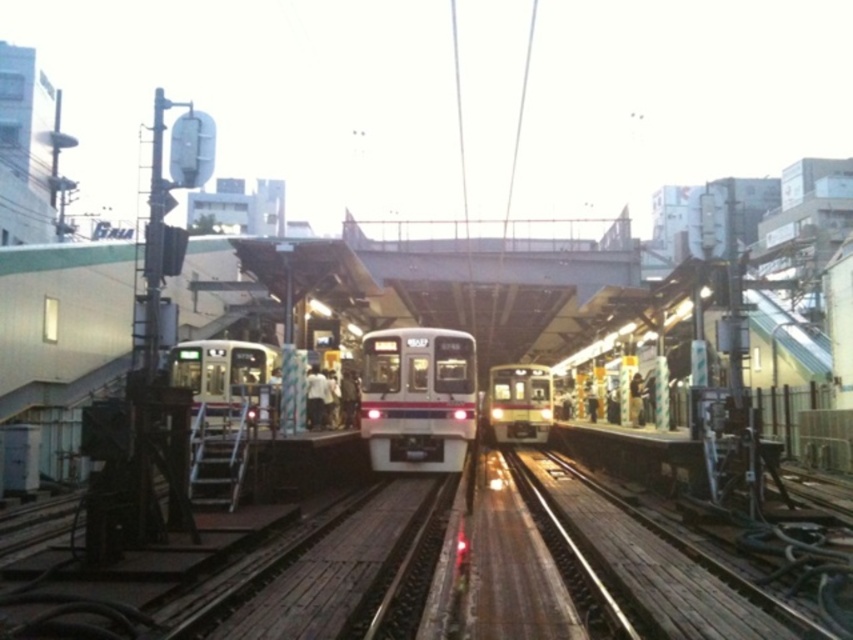
Question: Can you confirm if white glossy train at center is positioned above metallic silver train at center?

Choices:
 (A) no
 (B) yes

Answer: (B)

Question: Does white glossy train at center have a smaller size compared to metallic silver train at center?

Choices:
 (A) no
 (B) yes

Answer: (A)

Question: Considering the real-world distances, which object is farthest from the metallic silver train at center?

Choices:
 (A) white glossy train at center
 (B) silver metallic train at center

Answer: (B)

Question: Estimate the real-world distances between objects in this image. Which object is closer to the metallic silver train at center?

Choices:
 (A) silver metallic train at center
 (B) wooden planks at center

Answer: (B)

Question: Is silver metallic train at center above metallic silver train at center?

Choices:
 (A) no
 (B) yes

Answer: (B)

Question: Which is nearer to the silver metallic train at center?

Choices:
 (A) metallic silver train at center
 (B) wooden planks at center
 (C) white glossy train at center

Answer: (B)